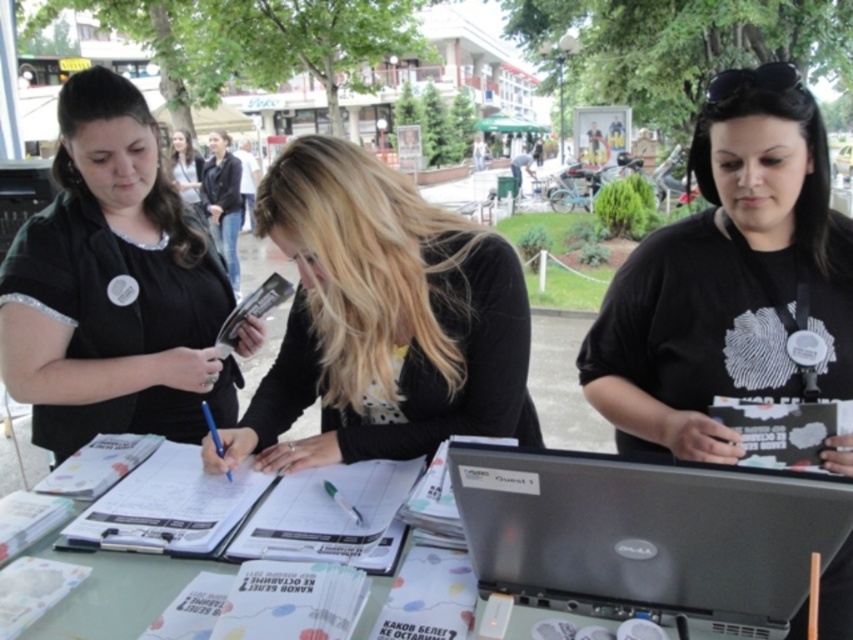
Is black dotted shirt at center further to camera compared to silver metallic laptop at center?

Yes, it is.

What are the coordinates of `black dotted shirt at center` in the screenshot? It's located at coord(381,317).

The height and width of the screenshot is (640, 853). In order to click on black dotted shirt at center in this screenshot , I will do `click(381, 317)`.

Is clear glass table at center thinner than matte black shirt at center?

Correct, clear glass table at center's width is less than matte black shirt at center's.

Is clear glass table at center above matte black shirt at center?

Incorrect, clear glass table at center is not positioned above matte black shirt at center.

Which is behind, point (160, 589) or point (190, 180)?

The point (190, 180) is behind.

The height and width of the screenshot is (640, 853). Find the location of `clear glass table at center`. clear glass table at center is located at coordinates 113,593.

Does black matte shirt at center have a smaller size compared to clear glass table at center?

No.

Image resolution: width=853 pixels, height=640 pixels. What are the coordinates of `black matte shirt at center` in the screenshot? It's located at (729, 280).